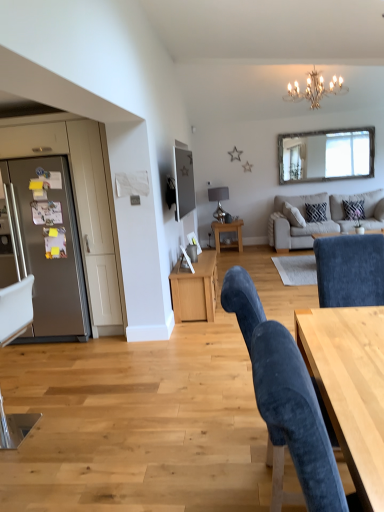
You are a GUI agent. You are given a task and a screenshot of the screen. Output one action in this format:
    pyautogui.click(x=<x>, y=<y>)
    Task: Click on the free space that is in between velvet blue chair at lower right, which ranks as the first chair in right-to-left order, and metallic silver chair at left, the 1th chair from the back
    This screenshot has height=512, width=384.
    Given the screenshot: What is the action you would take?
    pyautogui.click(x=142, y=456)